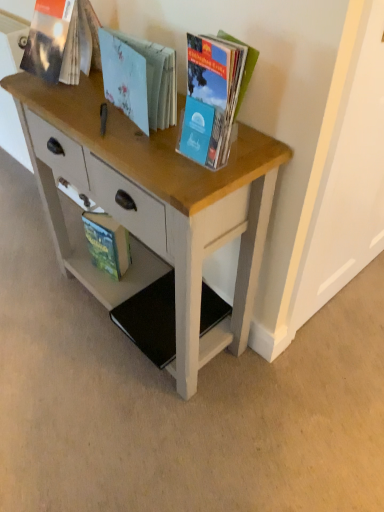
This screenshot has width=384, height=512. Find the location of `vacant space that is to the left of wooden desk at center`. vacant space that is to the left of wooden desk at center is located at coordinates (45, 309).